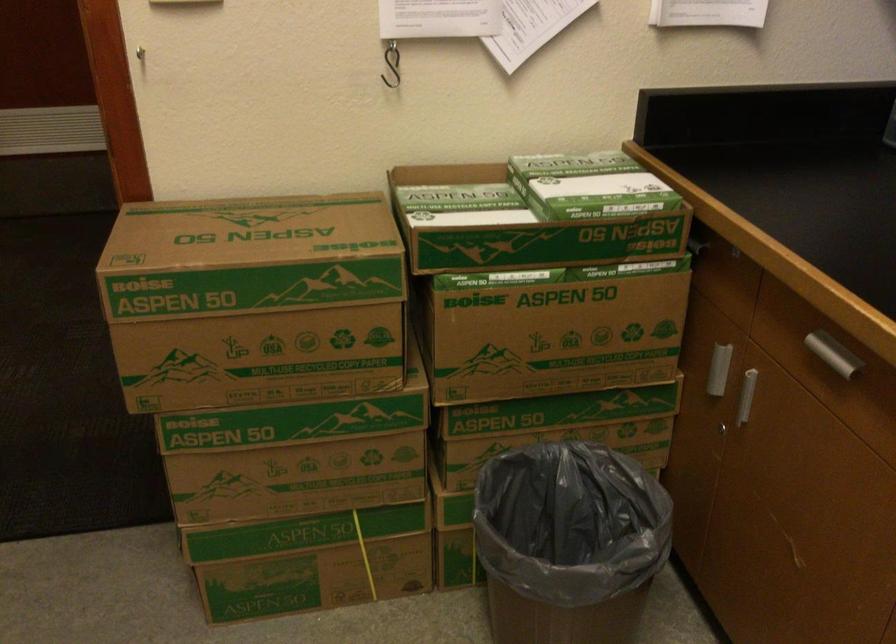
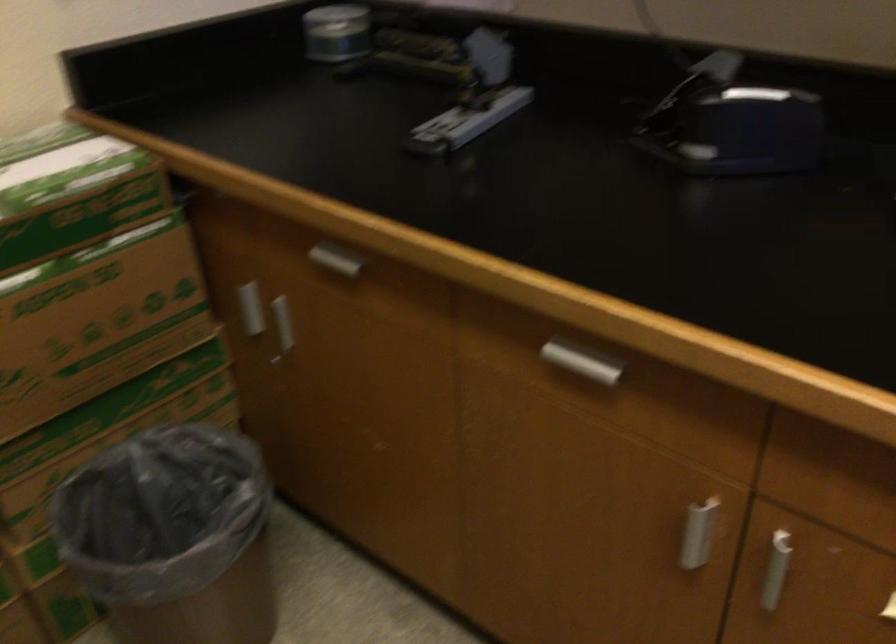
Find the pixel in the second image that matches (600,198) in the first image.

(67, 176)